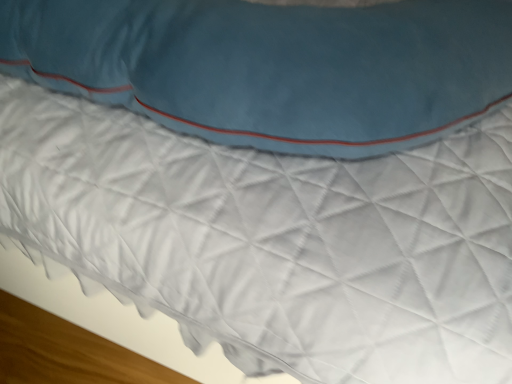
Measure the distance between point (98,69) and camera.

Point (98,69) and camera are 20.43 inches apart.

The height and width of the screenshot is (384, 512). What do you see at coordinates (273, 67) in the screenshot? I see `blue fabric pillow at upper center` at bounding box center [273, 67].

Locate an element on the screen. This screenshot has height=384, width=512. blue fabric pillow at upper center is located at coordinates (273, 67).

I want to click on blue fabric pillow at upper center, so click(x=273, y=67).